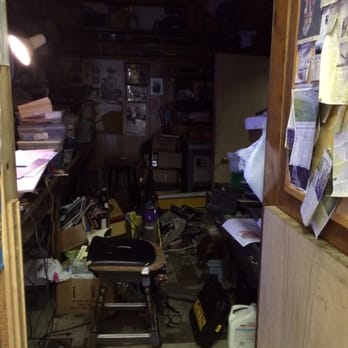
At what (x,y) coordinates should I click in order to perform the action: click on lamp. Please return your answer as a coordinate pair (x, y). Looking at the image, I should click on (41, 39).